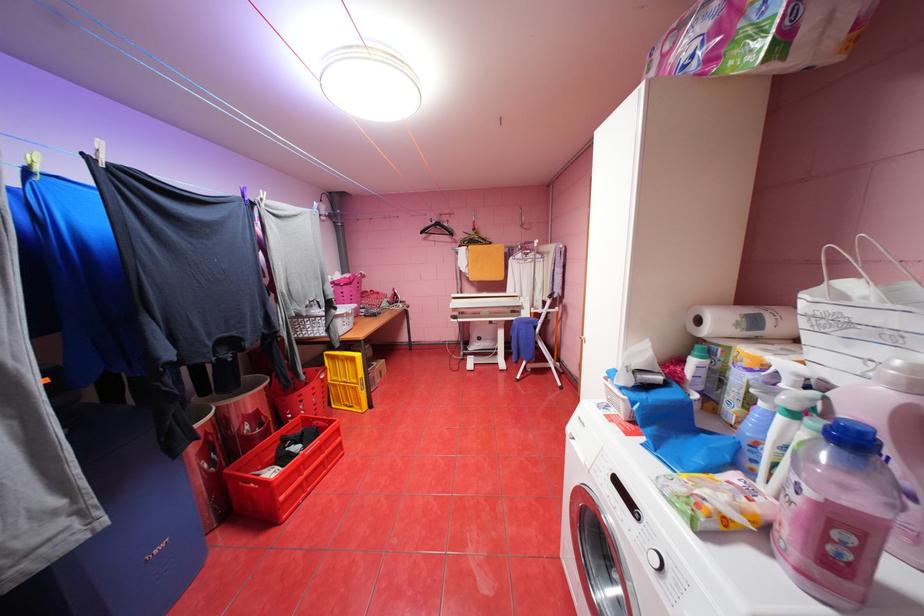
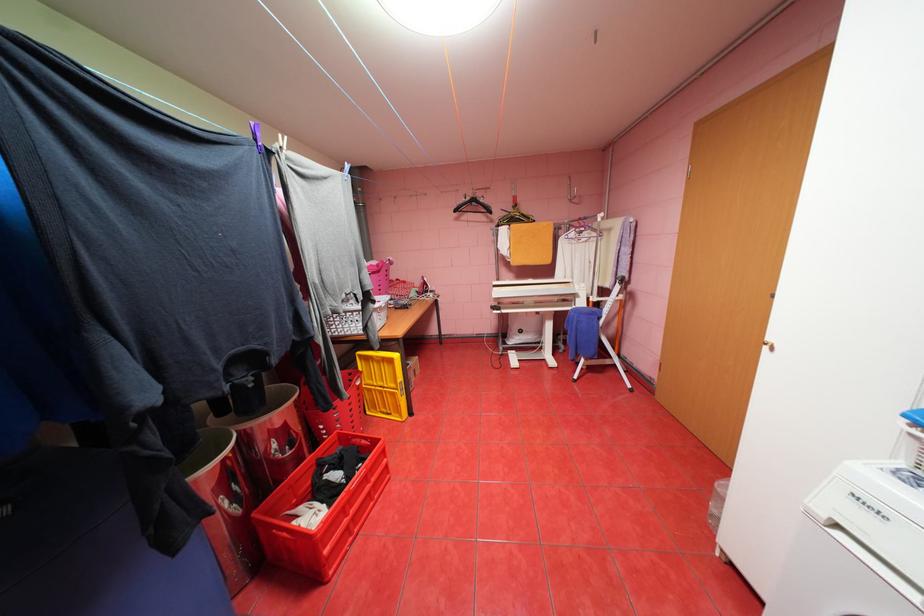
Locate, in the second image, the point that corresponds to [314,421] in the first image.

(351, 438)